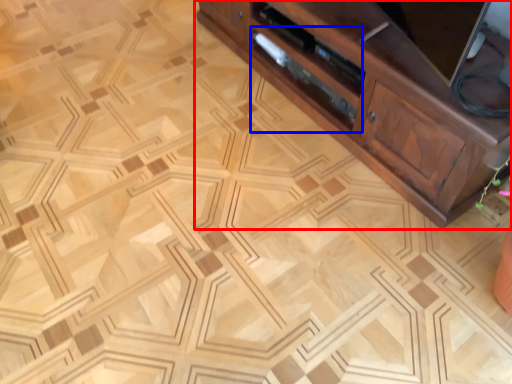
Question: Which object is closer to the camera taking this photo, cabinetry (highlighted by a red box) or drawer (highlighted by a blue box)?

Choices:
 (A) cabinetry
 (B) drawer

Answer: (A)